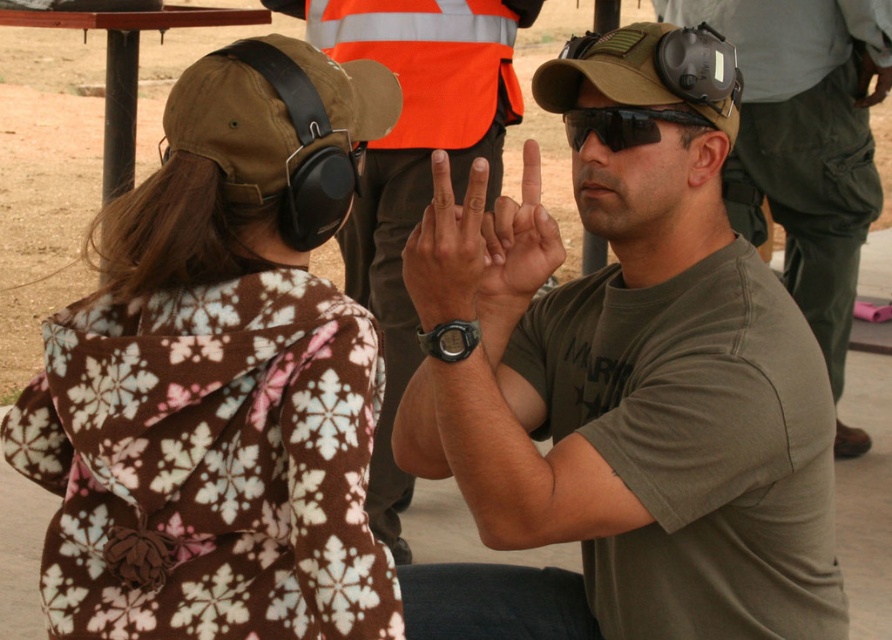
You are standing in the scene and want to hand a tool to the person wearing the brown fabric baseball hat at center. Which direction should you move relative to the matte black watch at center to reach them?

The brown fabric baseball hat at center is to the right of the matte black watch at center, so you should move to the right of the matte black watch at center to reach them.